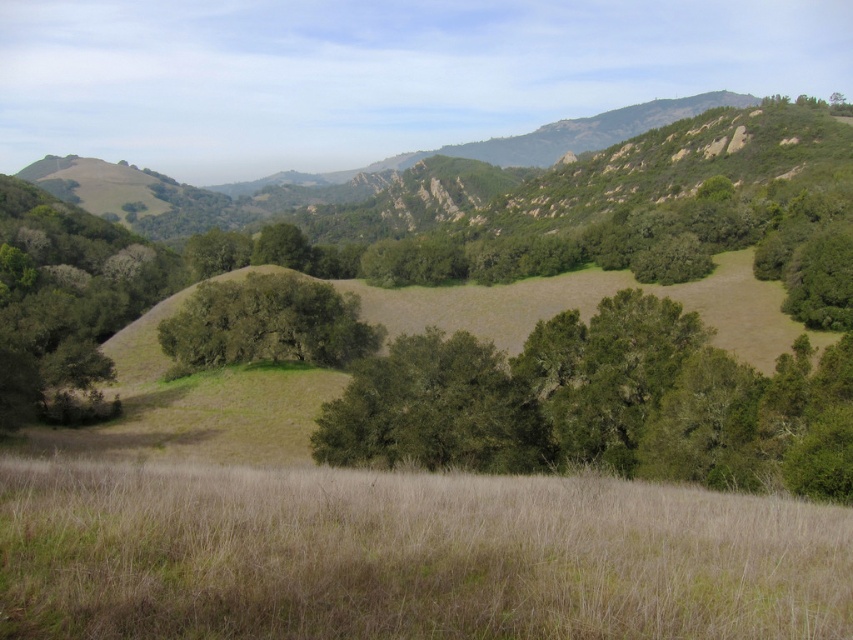
The image size is (853, 640). What do you see at coordinates (405, 556) in the screenshot?
I see `dry grass at lower center` at bounding box center [405, 556].

Is dry grass at lower center bigger than green leafy tree at center?

Incorrect, dry grass at lower center is not larger than green leafy tree at center.

Is point (184, 538) positioned in front of point (328, 291)?

Yes, point (184, 538) is closer to viewer.

This screenshot has height=640, width=853. What are the coordinates of `dry grass at lower center` in the screenshot? It's located at (405, 556).